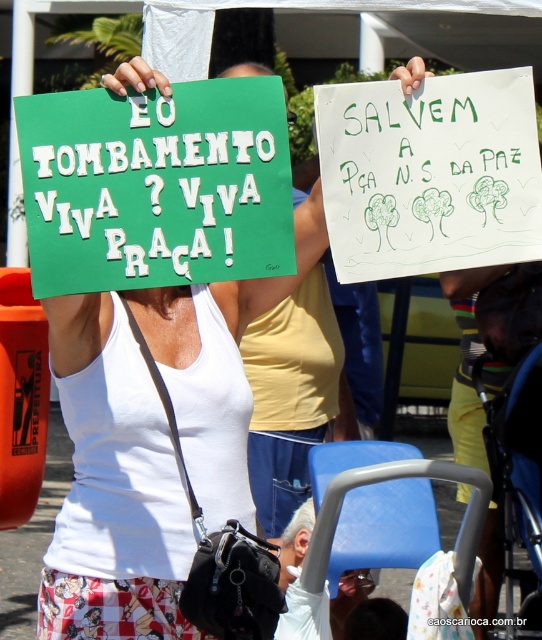
You are a photographer trying to capture the two protesters in the scene. You want to ensure both the green paper sign at center and the gray hair at center are visible in your shot. Based on their positions, which object should you focus on first to frame the shot properly?

The green paper sign at center is positioned on the left side of gray hair at center, so you should focus on the green paper sign at center first to ensure both are in frame.